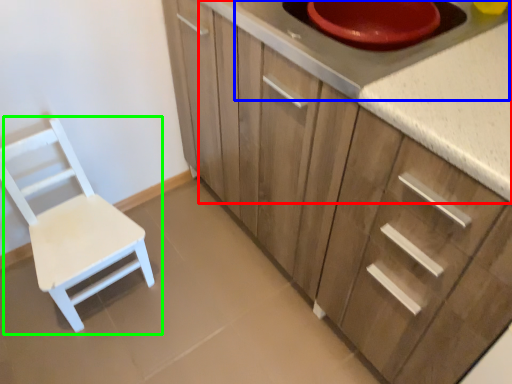
Question: Considering the real-world distances, which object is closest to countertop (highlighted by a red box)? appliance (highlighted by a blue box) or chair (highlighted by a green box).

Choices:
 (A) appliance
 (B) chair

Answer: (A)